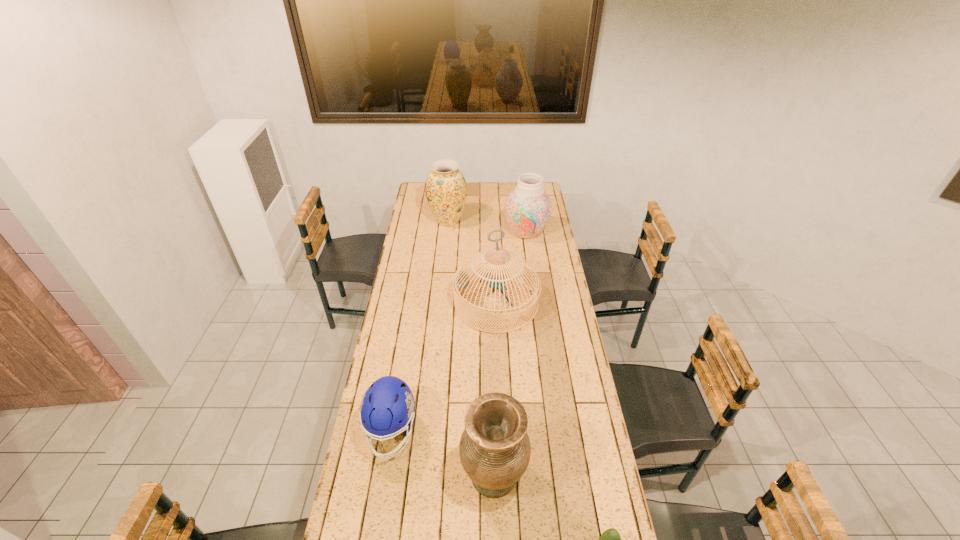
Identify the location of vase that is the closest to the avocado. The height and width of the screenshot is (540, 960). 494,448.

I want to click on free space that satisfies the following two spatial constraints: 1. on the face guard of the football helmet; 2. on the right side of the nearest vase, so click(384, 475).